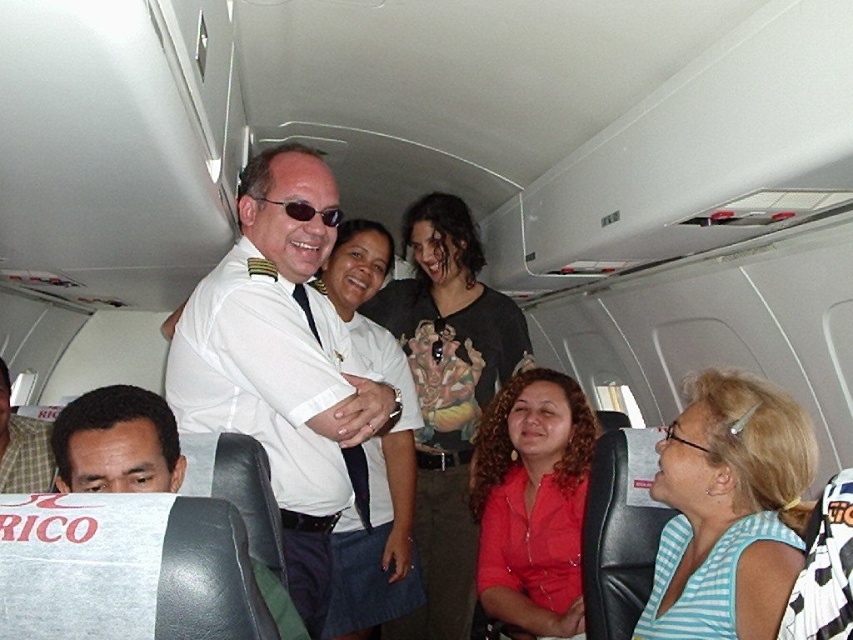
Is white uniform at center to the left of blue striped shirt at lower right from the viewer's perspective?

Correct, you'll find white uniform at center to the left of blue striped shirt at lower right.

From the picture: Does white uniform at center have a greater height compared to blue striped shirt at lower right?

Indeed, white uniform at center has a greater height compared to blue striped shirt at lower right.

Is point (308, 273) farther from camera compared to point (677, 492)?

No.

Where is `white uniform at center`? The height and width of the screenshot is (640, 853). white uniform at center is located at coordinates (282, 362).

Can you confirm if white uniform at center is positioned to the right of smooth skin face at lower left?

Indeed, white uniform at center is positioned on the right side of smooth skin face at lower left.

Is the position of white uniform at center more distant than that of smooth skin face at lower left?

That is True.

What do you see at coordinates (282, 362) in the screenshot? The height and width of the screenshot is (640, 853). I see `white uniform at center` at bounding box center [282, 362].

This screenshot has height=640, width=853. In order to click on white uniform at center in this screenshot , I will do `click(282, 362)`.

This screenshot has height=640, width=853. I want to click on white shirt at center, so click(373, 452).

Who is more forward, (398, 372) or (155, 419)?

Point (155, 419) is more forward.

Locate an element on the screen. This screenshot has height=640, width=853. white shirt at center is located at coordinates (373, 452).